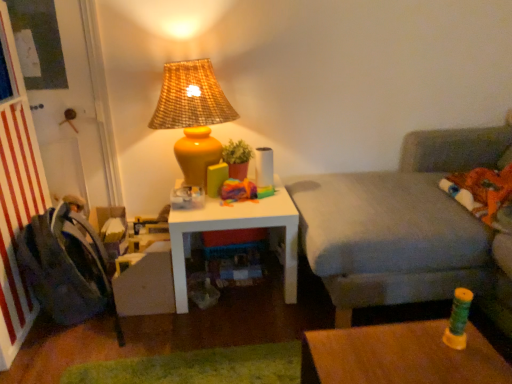
Question: From a real-world perspective, is gray fabric couch at right physically located above or below dark gray fabric swivel chair at left?

Choices:
 (A) below
 (B) above

Answer: (B)

Question: Considering the relative positions of gray fabric couch at right and dark gray fabric swivel chair at left in the image provided, is gray fabric couch at right to the left or to the right of dark gray fabric swivel chair at left?

Choices:
 (A) right
 (B) left

Answer: (A)

Question: Considering the real-world distances, which object is farthest from the matte yellow vase at upper center?

Choices:
 (A) dark gray fabric swivel chair at left
 (B) white matte table at center
 (C) gray fabric couch at right

Answer: (C)

Question: Estimate the real-world distances between objects in this image. Which object is farther from the dark gray fabric swivel chair at left?

Choices:
 (A) matte yellow vase at upper center
 (B) white matte table at center
 (C) gray fabric couch at right

Answer: (C)